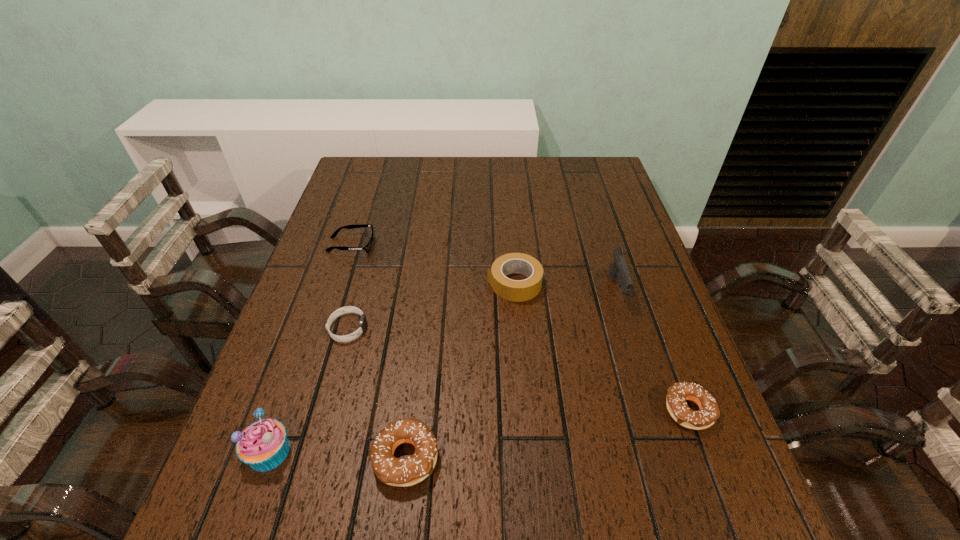
The height and width of the screenshot is (540, 960). Identify the location of wristband at the left edge. (348, 309).

The height and width of the screenshot is (540, 960). In order to click on muffin located in the left edge section of the desktop in this screenshot , I will do `click(263, 445)`.

The image size is (960, 540). In order to click on doughnut present at the right edge in this screenshot , I will do tap(677, 394).

Find the location of a particular element. pistol at the right edge is located at coordinates (618, 267).

Where is `object that is at the near left corner`? The width and height of the screenshot is (960, 540). object that is at the near left corner is located at coordinates (263, 445).

Where is `object located at the near right corner`? object located at the near right corner is located at coordinates (677, 394).

Locate an element on the screen. vacant space at the far edge of the desktop is located at coordinates (416, 185).

The height and width of the screenshot is (540, 960). What are the coordinates of `vacant space at the near edge of the desktop` in the screenshot? It's located at (357, 443).

What are the coordinates of `free space at the left edge of the desktop` in the screenshot? It's located at (308, 273).

Find the location of a particular element. This screenshot has width=960, height=540. vacant space at the right edge is located at coordinates [x=575, y=203].